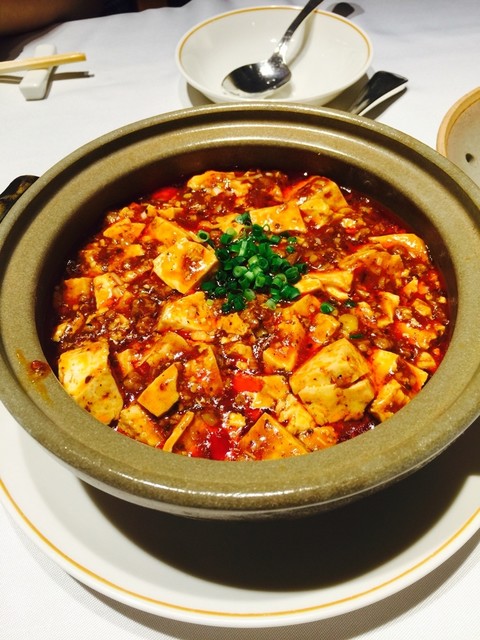
Identify the location of green bowl. (441, 420).